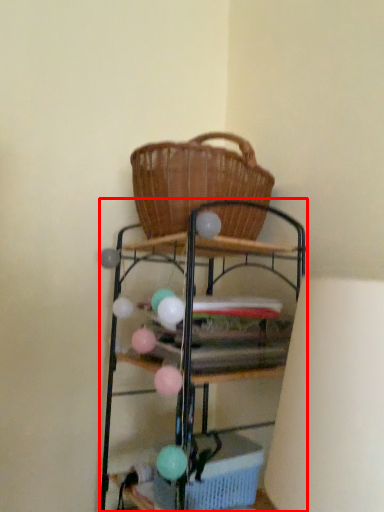
Question: From the image's perspective, what is the correct spatial positioning of shelf (annotated by the red box) in reference to basket?

Choices:
 (A) below
 (B) above

Answer: (B)